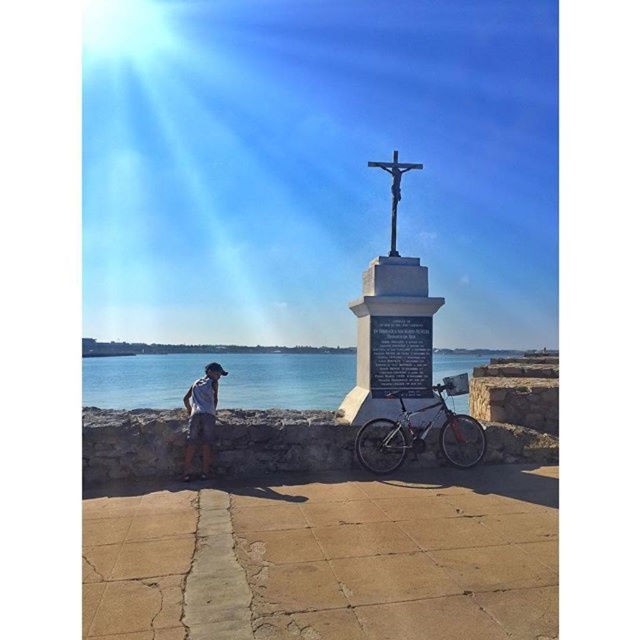
Consider the image. You are a tourist standing at the entrance of the stone path leading to the monument. You see the polished stone cross at center and the silver metallic bicycle at center. Which object is closer to your right side?

The silver metallic bicycle at center is closer to your right side because the polished stone cross at center is to the left of it.

You are standing at the monument and want to walk towards the person. Which point, point [355,364] or point [472,451], is closer to you?

Point [355,364] is closer to you because it is further to the viewer than point [472,451].